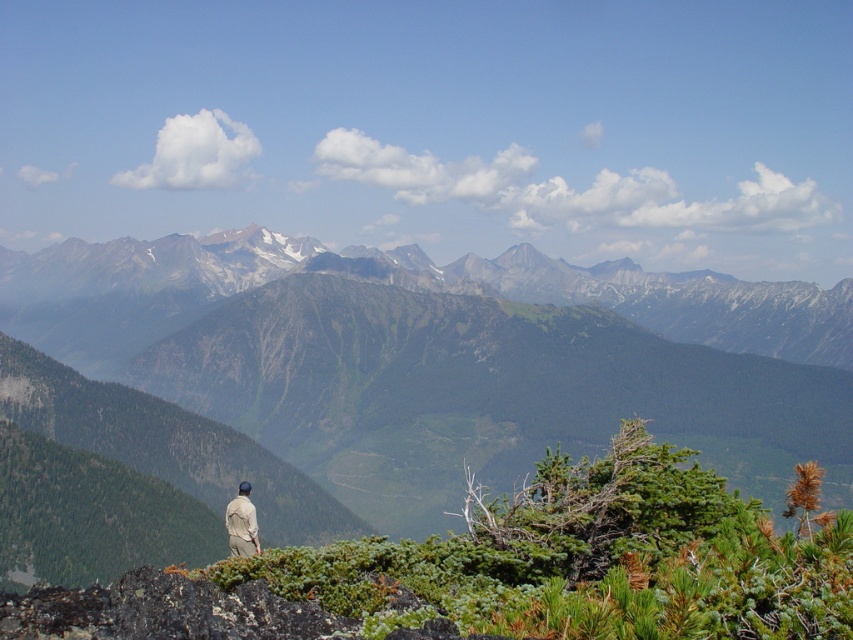
You are a GUI agent. You are given a task and a screenshot of the screen. Output one action in this format:
    pyautogui.click(x=<x>, y=<y>)
    Task: Click on the green grassy mountain range at center
    The image size is (853, 640).
    Given the screenshot: What is the action you would take?
    pyautogui.click(x=445, y=356)

Consider the image. Can you confirm if green grassy mountain range at center is shorter than tan fabric jacket at lower left?

Incorrect, green grassy mountain range at center's height does not fall short of tan fabric jacket at lower left's.

Is point (502, 472) farther from camera compared to point (230, 506)?

That is True.

This screenshot has height=640, width=853. In order to click on green grassy mountain range at center in this screenshot , I will do `click(445, 356)`.

Is green rocky mountains at center to the right of tan fabric jacket at lower left from the viewer's perspective?

No, green rocky mountains at center is not to the right of tan fabric jacket at lower left.

Does point (730, 348) come closer to viewer compared to point (225, 515)?

No.

Locate an element on the screen. The width and height of the screenshot is (853, 640). green rocky mountains at center is located at coordinates (395, 285).

Is green grassy mountain range at center positioned at the back of green rocky mountains at center?

No, it is not.

The height and width of the screenshot is (640, 853). What do you see at coordinates (445, 356) in the screenshot? I see `green grassy mountain range at center` at bounding box center [445, 356].

Is point (326, 324) less distant than point (833, 292)?

Yes, it is.

This screenshot has height=640, width=853. Find the location of `green grassy mountain range at center`. green grassy mountain range at center is located at coordinates (445, 356).